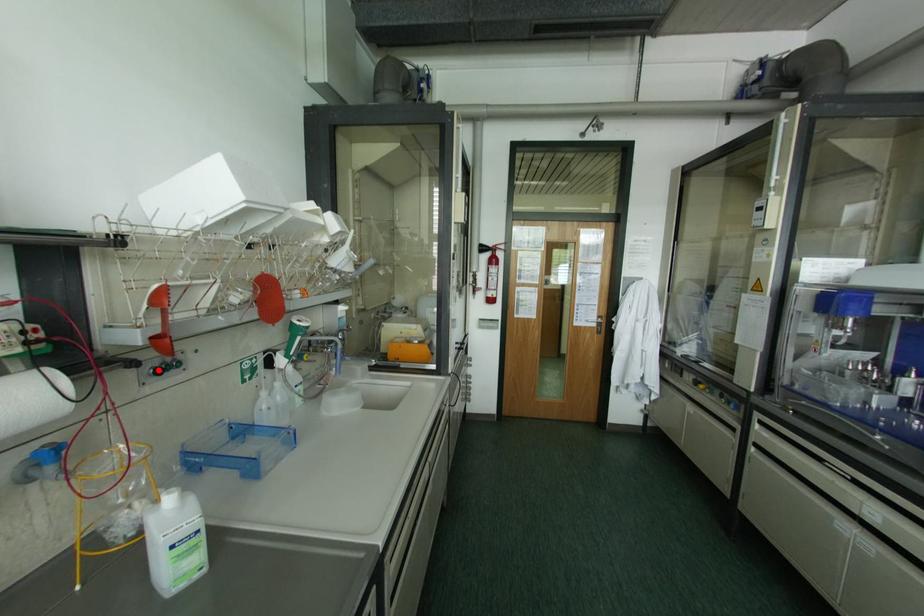
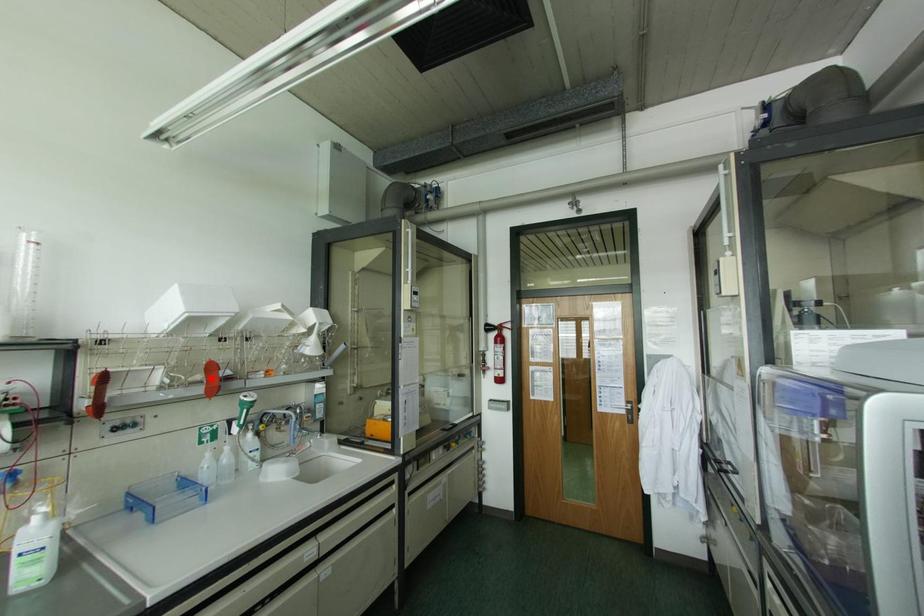
I am providing you with two images of the same scene from different viewpoints. A red point is marked on the first image and another point is marked on the second image. Does the point marked in image1 correspond to the same location as the one in image2?

No